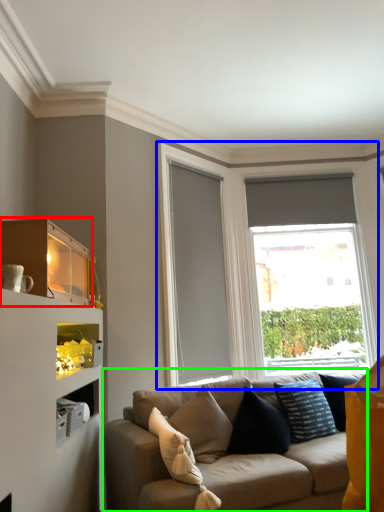
Question: Which object is positioned farthest from shelf (highlighted by a red box)? Select from window (highlighted by a blue box) and studio couch (highlighted by a green box).

Choices:
 (A) window
 (B) studio couch

Answer: (A)